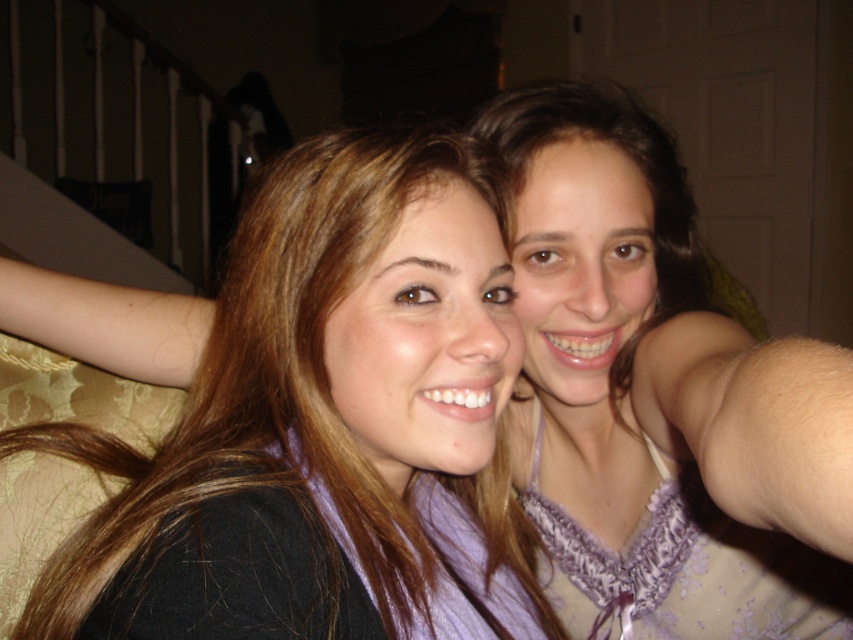
You are a photographer trying to adjust the lighting for a photo shoot. You notice the matte purple scarf at center and the purple lace dress at upper right. Which item is covering part of the other?

The matte purple scarf at center is positioned over the purple lace dress at upper right, so the scarf is covering part of the dress.

You are a fashion designer analyzing the image. You need to determine which item is smaller between the matte purple scarf at center and the purple lace dress at upper right. Which one is smaller?

The matte purple scarf at center is smaller compared to the purple lace dress at upper right.